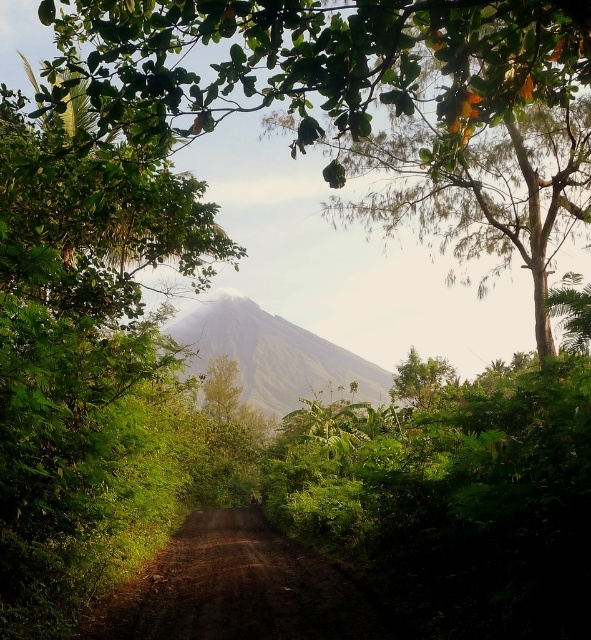
Based on the photo, you are standing on the dirt path and want to take a photo of both the green leafy tree at center and the green grassy mountain at center. Which object will appear closer to the camera in the photo?

The green leafy tree at center will appear closer to the camera in the photo because it is positioned in front of the green grassy mountain at center.